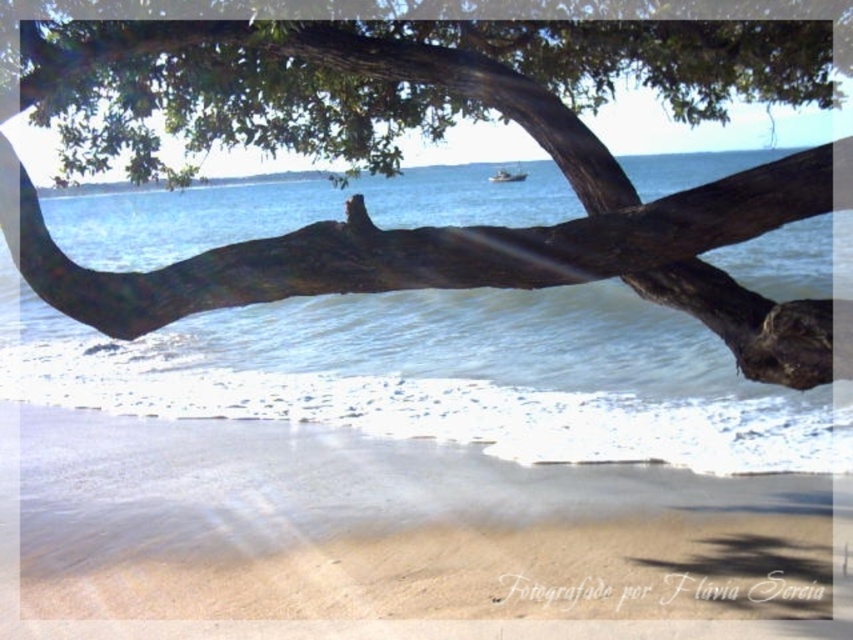
Question: Which of the following is the farthest from the observer?

Choices:
 (A) (511, 180)
 (B) (573, 276)

Answer: (A)

Question: Does smooth brown branch at upper center have a larger size compared to sandy beach at lower center?

Choices:
 (A) no
 (B) yes

Answer: (B)

Question: Is smooth brown branch at upper center to the right of metallic silver boat at center from the viewer's perspective?

Choices:
 (A) yes
 (B) no

Answer: (B)

Question: Where is sandy beach at lower center located in relation to metallic silver boat at center in the image?

Choices:
 (A) right
 (B) left

Answer: (B)

Question: Which object is the closest to the metallic silver boat at center?

Choices:
 (A) smooth brown branch at upper center
 (B) sandy beach at lower center

Answer: (A)

Question: Which point appears farthest from the camera in this image?

Choices:
 (A) (508, 177)
 (B) (341, 436)

Answer: (A)